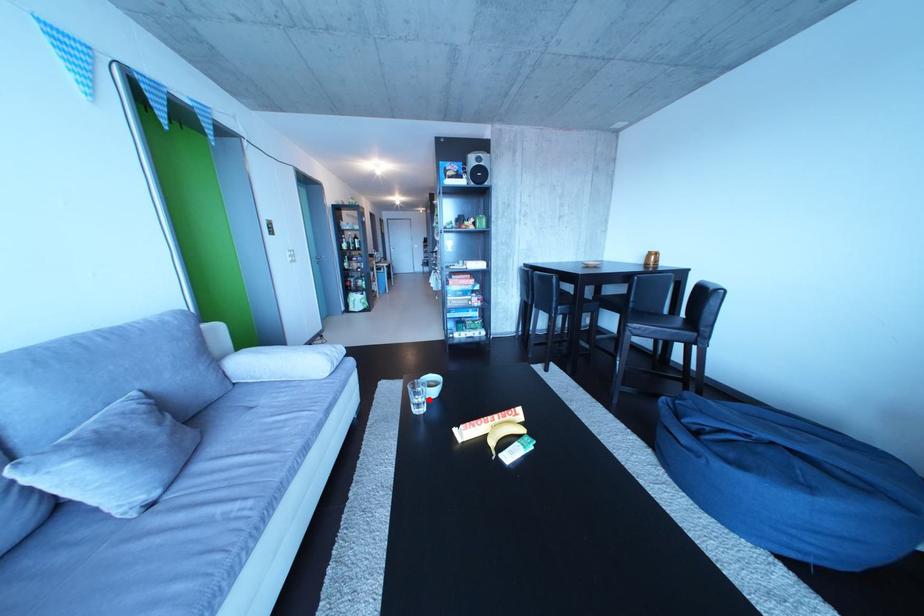
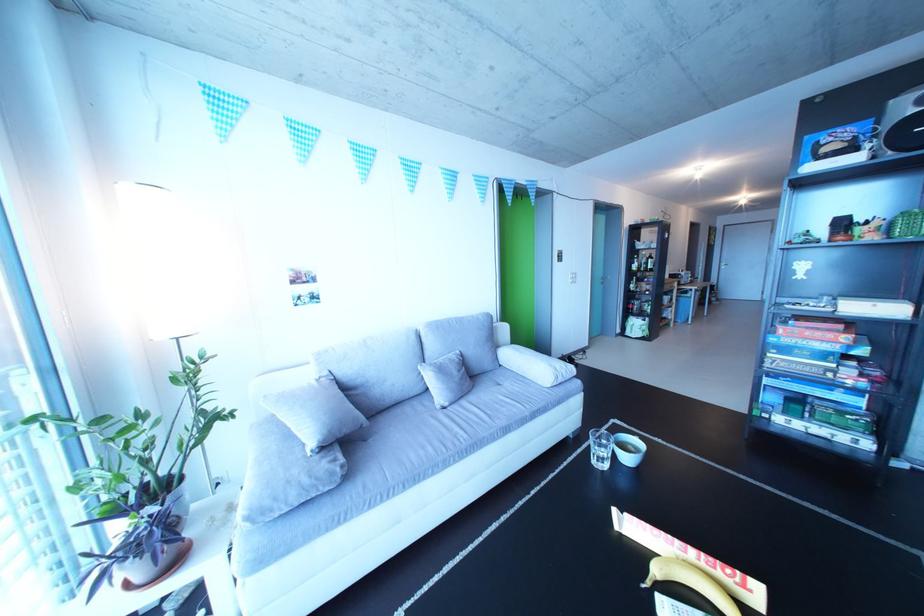
The point at the highlighted location is marked in the first image. Where is the corresponding point in the second image?

(614, 451)